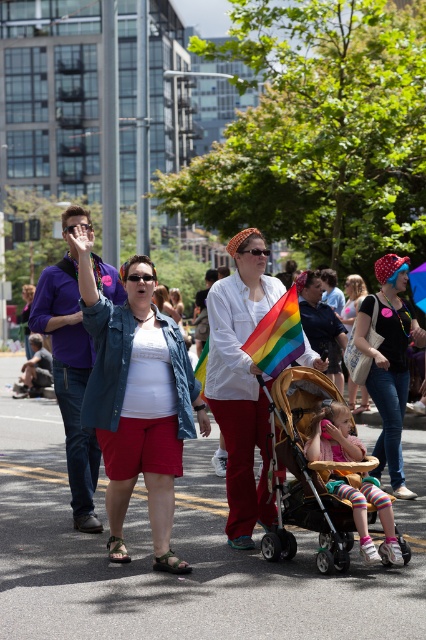
Is denim jacket at center to the left of matte black shirt at center from the viewer's perspective?

Yes, denim jacket at center is to the left of matte black shirt at center.

The height and width of the screenshot is (640, 426). I want to click on denim jacket at center, so 137,396.

Can you confirm if rainbow flag at center is shorter than denim jacket at center?

No.

Is rainbow flag at center positioned behind denim jacket at center?

Yes, rainbow flag at center is behind denim jacket at center.

Who is more distant from viewer, (x=172, y=419) or (x=118, y=520)?

Positioned behind is point (x=118, y=520).

Where is `rainbow flag at center`? rainbow flag at center is located at coordinates (132, 388).

Can you confirm if denim jacket at center is thinner than wooden baby carriage at center?

In fact, denim jacket at center might be wider than wooden baby carriage at center.

The image size is (426, 640). Find the location of `denim jacket at center`. denim jacket at center is located at coordinates coord(137,396).